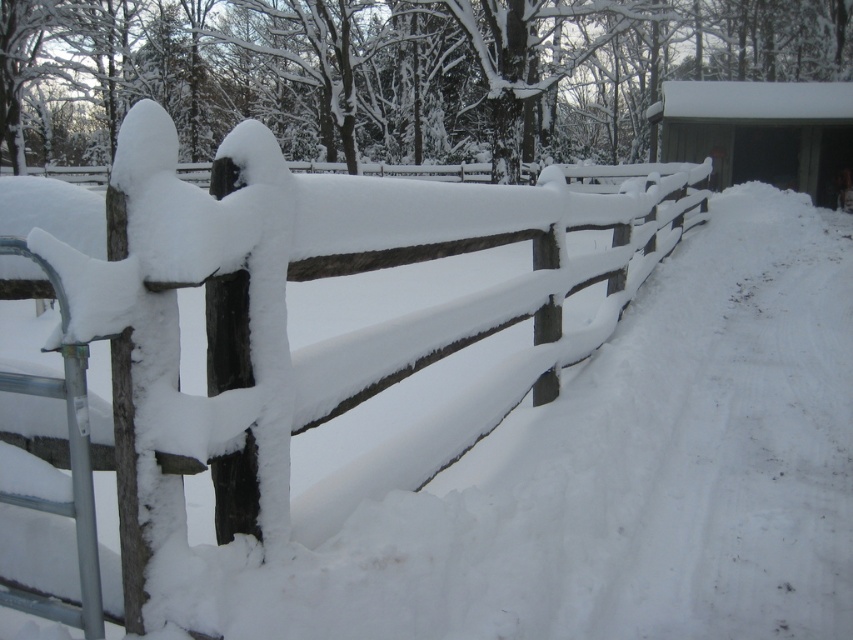
Question: Can you confirm if wooden fence at center is positioned above wooden cabin at upper right?

Choices:
 (A) no
 (B) yes

Answer: (A)

Question: Is wooden fence at center wider than wooden cabin at upper right?

Choices:
 (A) yes
 (B) no

Answer: (B)

Question: Is wooden fence at center bigger than wooden cabin at upper right?

Choices:
 (A) no
 (B) yes

Answer: (A)

Question: Which of the following is the closest to the observer?

Choices:
 (A) (556, 244)
 (B) (828, 150)

Answer: (A)